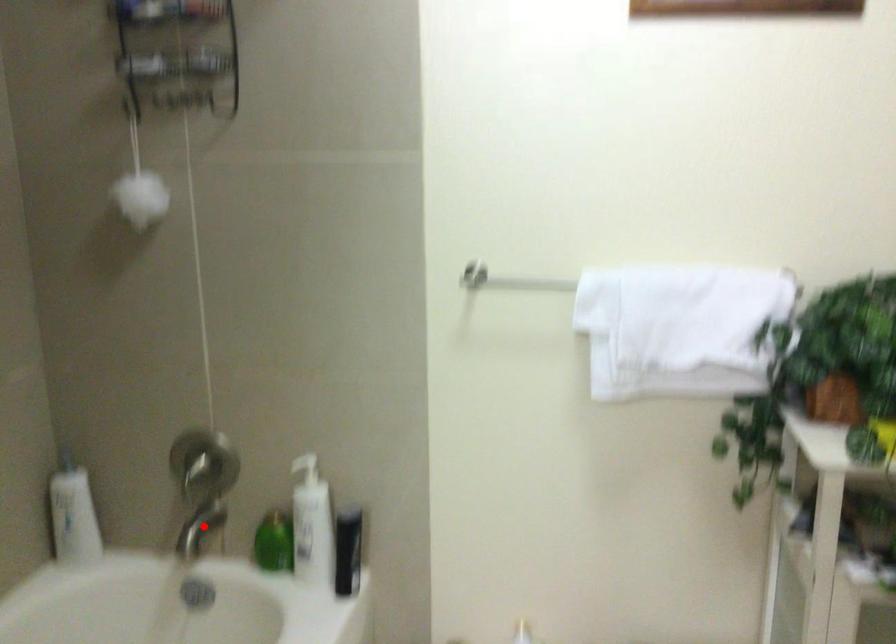
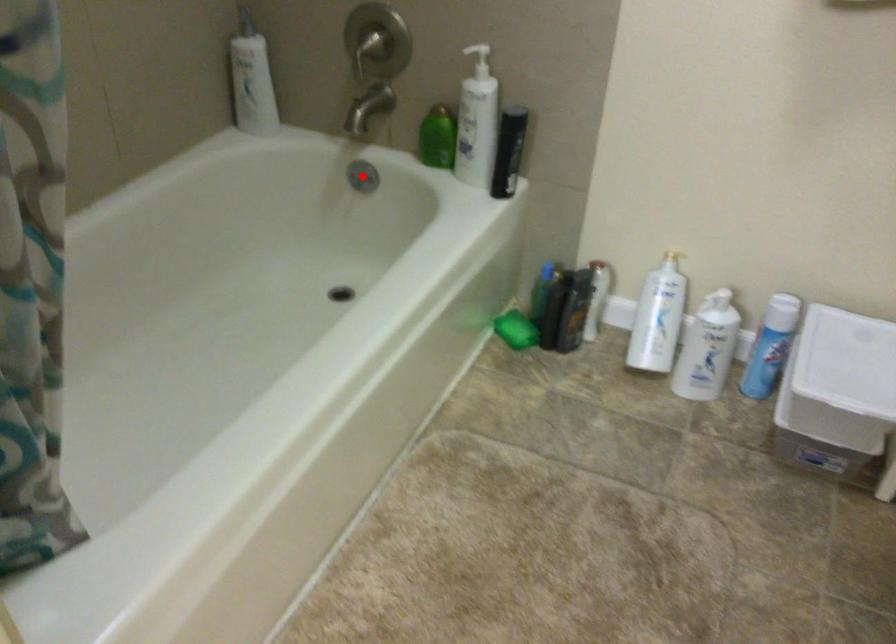
I am providing you with two images of the same scene from different viewpoints. A red point is marked on the first image and another point is marked on the second image. Are the points marked in image1 and image2 representing the same 3D position?

No